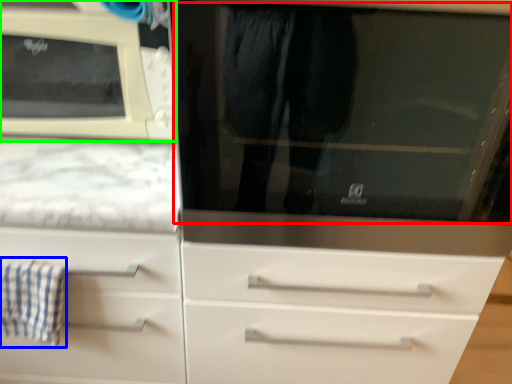
Question: Considering the real-world distances, which object is closest to glass door (highlighted by a red box)? bath towel (highlighted by a blue box) or microwave oven (highlighted by a green box).

Choices:
 (A) bath towel
 (B) microwave oven

Answer: (B)